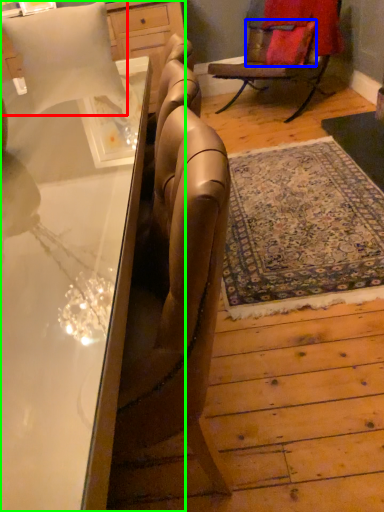
Question: Considering the real-world distances, which object is farthest from pillow (highlighted by a red box)? pillow (highlighted by a blue box) or desk (highlighted by a green box)?

Choices:
 (A) pillow
 (B) desk

Answer: (A)